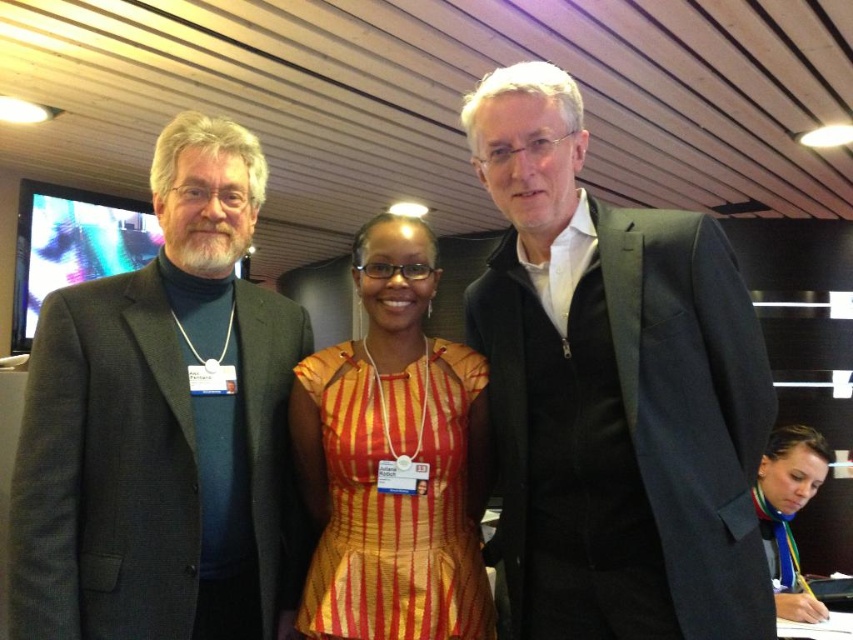
You are a photographer at a conference who needs to capture a group photo of the dark gray suit at left and the orange striped dress at center. The camera you are using has a minimum focus distance of 20 centimeters. Can you take a photo of both subjects without moving them?

The dark gray suit at left and orange striped dress at center are 22.77 centimeters apart, which is greater than the camera minimum focus distance of 20 centimeters. Yes, you can take a photo of both subjects without moving them.

You are a photographer setting up for a group photo. You need to position two subjects wearing the matte black suit at center and the matte black jacket at lower right. Based on their current positions, which subject might require more space to accommodate their clothing?

The matte black suit at center might require more space since it is wider than the matte black jacket at lower right.

You are a photographer standing at the back of the room with a camera. You want to take a photo of the dark gray suit at left and ensure that the person wearing it is in focus. The minimum focusing distance of your camera is 1.2 meters. Can you take the photo without moving closer?

Yes, because the distance between you and the dark gray suit at left is 1.22 meters, which is just beyond the camera minimum focusing distance of 1.2 meters.